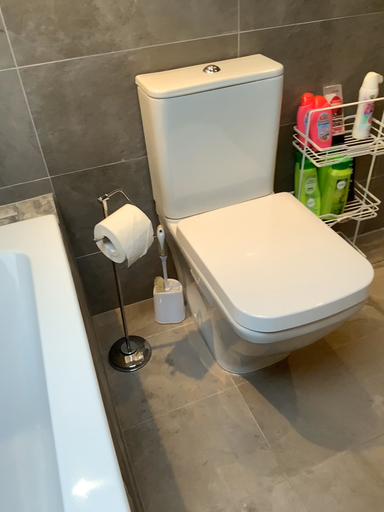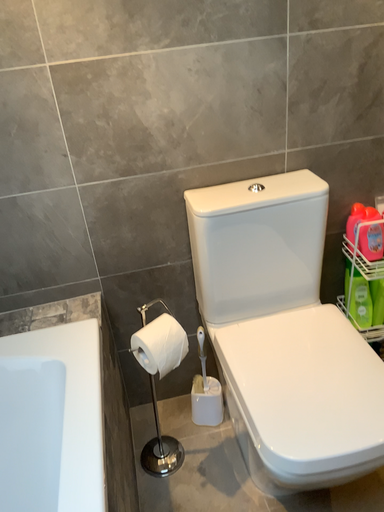
Question: Which way did the camera rotate in the video?

Choices:
 (A) rotated left
 (B) rotated right

Answer: (A)